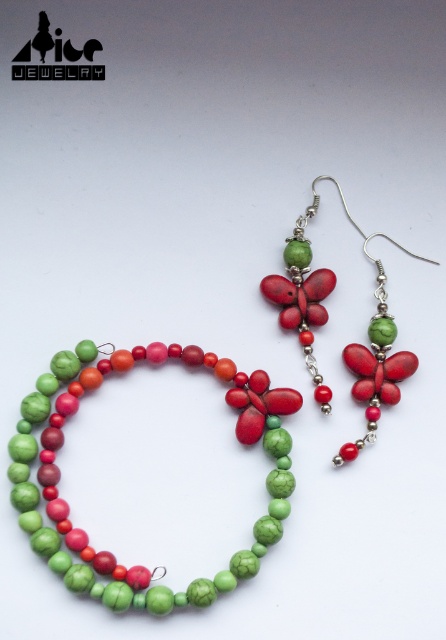
You are a jeweler who needs to ensure the necklace and earrings are displayed properly. The display case requires that the distance between the matte ceramic beads at center and the green matte beads at center must be exactly 4 centimeters. Based on the image, is the current spacing between them sufficient?

The matte ceramic beads at center is 3.95 centimeters away from green matte beads at center. Since 3.95 cm is just slightly less than 4 cm, the current spacing is insufficient and needs adjustment to meet the required distance.

You are a customer looking at the jewelry display. You see the matte ceramic beads at center and the matte red butterfly at center. Which one is positioned to the left?

The matte ceramic beads at center is positioned to the left of the matte red butterfly at center.